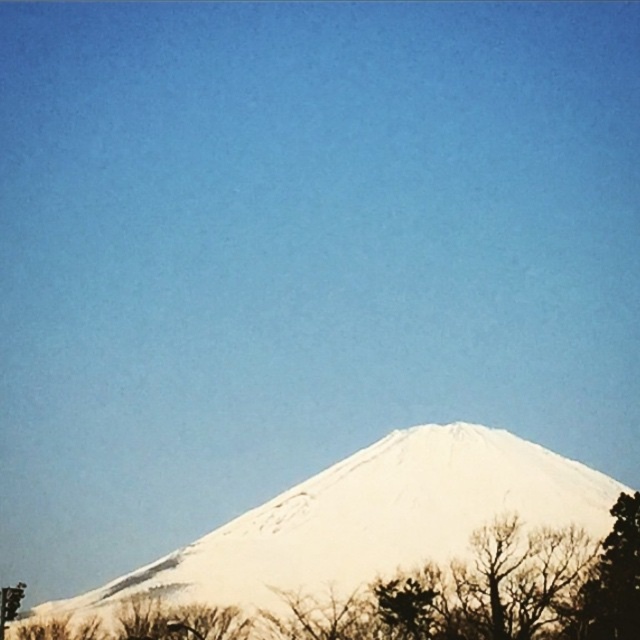
Is white snow-covered mountain at center positioned at the back of green leafy tree at lower right?

Yes, it is.

Who is taller, white snow-covered mountain at center or green leafy tree at lower right?

white snow-covered mountain at center

Who is more distant from viewer, (x=221, y=531) or (x=577, y=605)?

Positioned behind is point (x=221, y=531).

The width and height of the screenshot is (640, 640). Find the location of `white snow-covered mountain at center`. white snow-covered mountain at center is located at coordinates (371, 518).